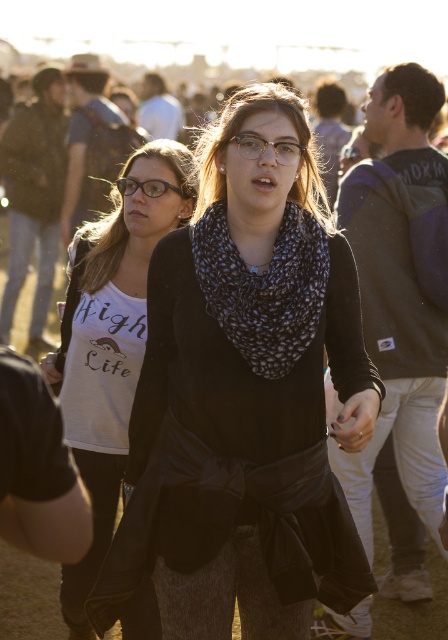
Which is behind, point (84, 563) or point (180, 189)?

The point (180, 189) is more distant.

Image resolution: width=448 pixels, height=640 pixels. What do you see at coordinates (112, 348) in the screenshot? I see `white matte t-shirt at center` at bounding box center [112, 348].

What are the coordinates of `white matte t-shirt at center` in the screenshot? It's located at (112, 348).

Is the position of black dotted scarf at center less distant than that of matte black glasses at center?

Yes, black dotted scarf at center is in front of matte black glasses at center.

Does black dotted scarf at center appear on the left side of matte black glasses at center?

Incorrect, black dotted scarf at center is not on the left side of matte black glasses at center.

You are a GUI agent. You are given a task and a screenshot of the screen. Output one action in this format:
    pyautogui.click(x=<x>, y=<y>)
    Task: Click on the black dotted scarf at center
    
    Given the screenshot: What is the action you would take?
    pyautogui.click(x=263, y=288)

Describe the element at coordinates (112, 348) in the screenshot. The height and width of the screenshot is (640, 448). I see `white matte t-shirt at center` at that location.

Is white matte t-shirt at center closer to camera compared to black dotted scarf at center?

No, white matte t-shirt at center is behind black dotted scarf at center.

In order to click on white matte t-shirt at center in this screenshot , I will do `click(112, 348)`.

Where is `white matte t-shirt at center`? The height and width of the screenshot is (640, 448). white matte t-shirt at center is located at coordinates (112, 348).